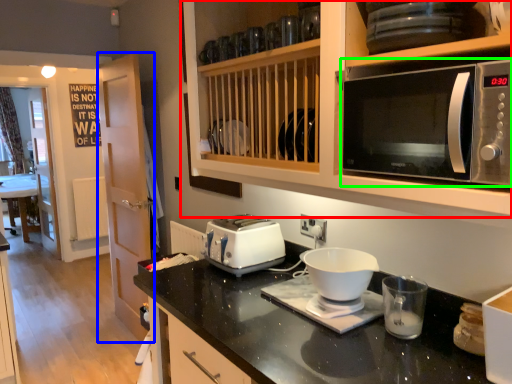
Question: Which is nearer to the cabinetry (highlighted by a red box)? glass door (highlighted by a blue box) or microwave oven (highlighted by a green box).

Choices:
 (A) glass door
 (B) microwave oven

Answer: (B)